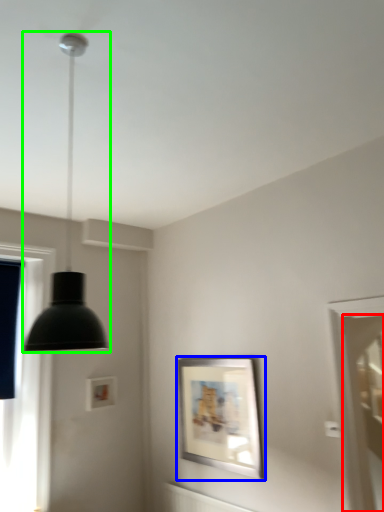
Question: Which is nearer to the screen door (highlighted by a red box)? picture frame (highlighted by a blue box) or lamp (highlighted by a green box).

Choices:
 (A) picture frame
 (B) lamp

Answer: (A)